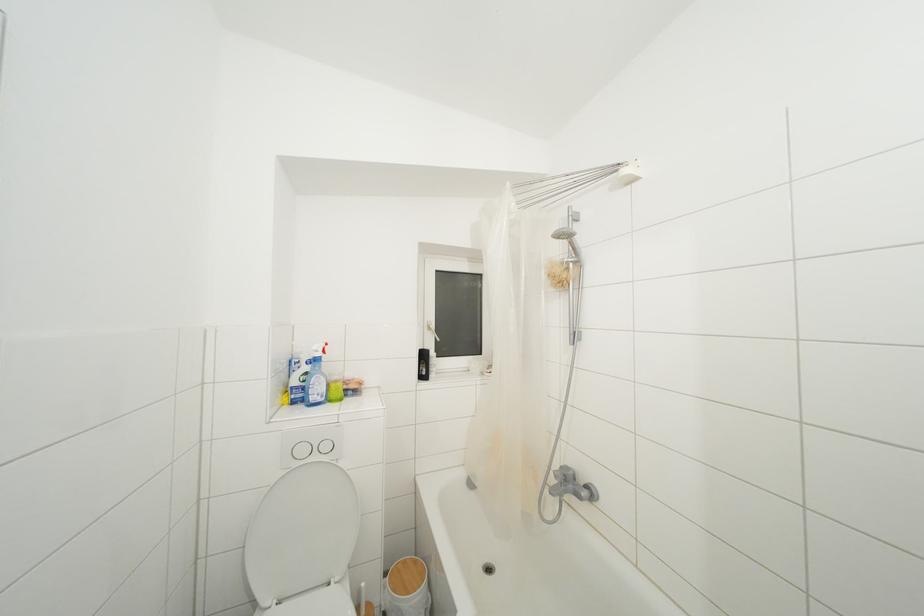
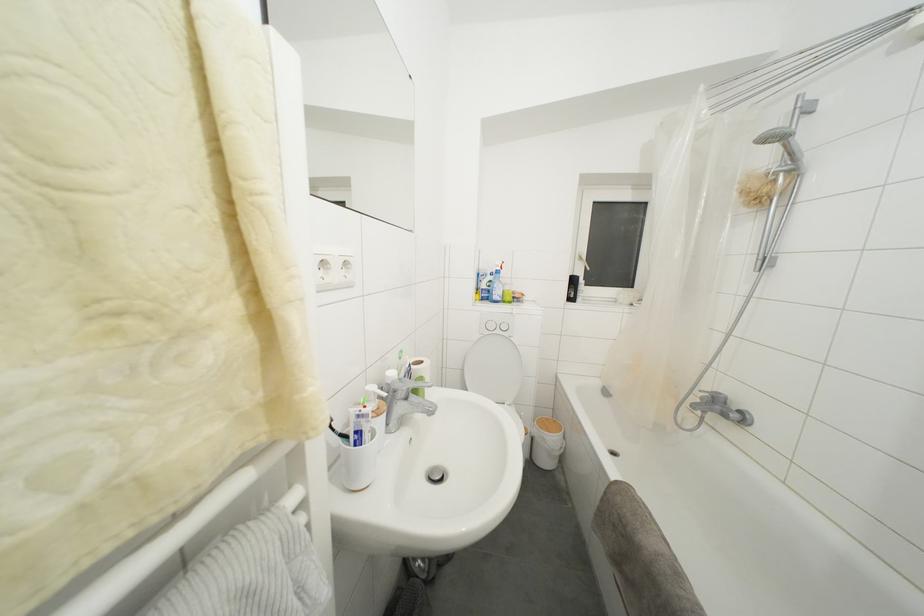
In the second image, find the point that corresponds to the point at 428,361 in the first image.

(578, 286)